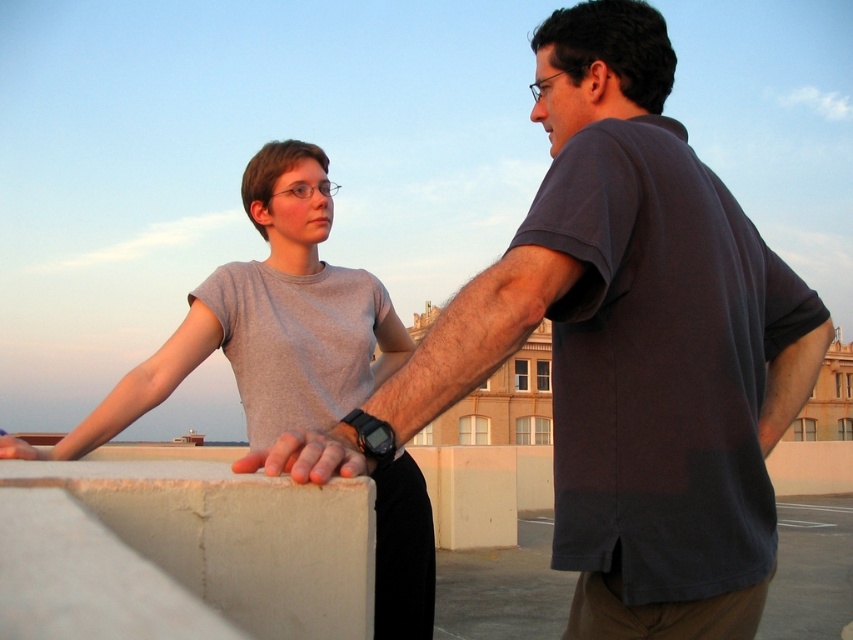
Who is taller, matte gray t-shirt at upper left or smooth tan skin at center?

Standing taller between the two is matte gray t-shirt at upper left.

Does matte gray t-shirt at upper left appear over smooth tan skin at center?

Indeed, matte gray t-shirt at upper left is positioned over smooth tan skin at center.

This screenshot has width=853, height=640. Find the location of `matte gray t-shirt at upper left`. matte gray t-shirt at upper left is located at coordinates (265, 321).

The width and height of the screenshot is (853, 640). Find the location of `matte gray t-shirt at upper left`. matte gray t-shirt at upper left is located at coordinates (265, 321).

Is dark gray t-shirt at center further to camera compared to smooth tan skin at center?

Yes, dark gray t-shirt at center is behind smooth tan skin at center.

Is dark gray t-shirt at center above smooth tan skin at center?

Yes, dark gray t-shirt at center is above smooth tan skin at center.

Which is behind, point (560, 45) or point (364, 474)?

Point (560, 45)

In order to click on dark gray t-shirt at center in this screenshot , I will do `click(633, 346)`.

Describe the element at coordinates (633, 346) in the screenshot. This screenshot has width=853, height=640. I see `dark gray t-shirt at center` at that location.

Is point (547, 292) farther from camera compared to point (350, 273)?

No, (547, 292) is in front of (350, 273).

This screenshot has height=640, width=853. In order to click on dark gray t-shirt at center in this screenshot , I will do `click(633, 346)`.